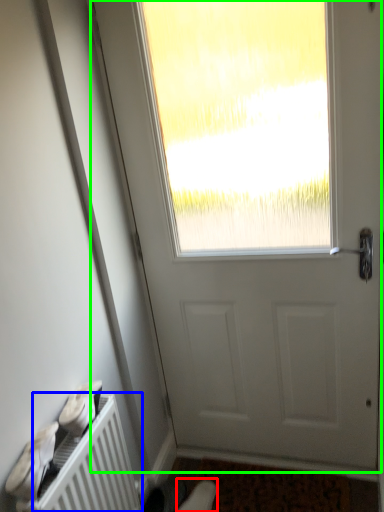
Question: Based on their relative distances, which object is nearer to shoe (highlighted by a red box)? Choose from radiator (highlighted by a blue box) and door (highlighted by a green box).

Choices:
 (A) radiator
 (B) door

Answer: (A)